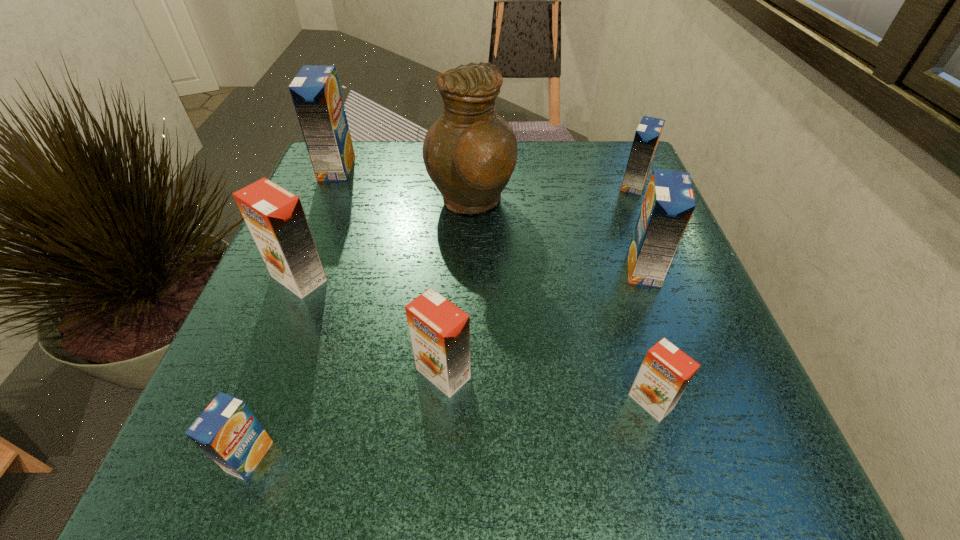
Identify the location of vacant area situated 0.130m on the back of the smallest blue orange_juice. The height and width of the screenshot is (540, 960). (287, 352).

This screenshot has height=540, width=960. Find the location of `pitcher that is at the far edge`. pitcher that is at the far edge is located at coordinates (470, 152).

This screenshot has width=960, height=540. Identify the location of object situated at the near edge. (227, 431).

This screenshot has height=540, width=960. I want to click on object that is at the far left corner, so click(315, 91).

At what (x,y) coordinates should I click in order to perform the action: click on object positioned at the near left corner. Please return your answer as a coordinate pair (x, y). This screenshot has height=540, width=960. Looking at the image, I should click on pos(227,431).

Identify the location of object positioned at the far right corner. (648, 133).

In the image, there is a desktop. In order to click on free space at the far edge in this screenshot , I will do `click(392, 178)`.

I want to click on vacant space at the near edge of the desktop, so click(x=355, y=430).

Locate an element on the screen. vacant region at the left edge of the desktop is located at coordinates (277, 287).

Locate an element on the screen. This screenshot has width=960, height=540. vacant space at the right edge of the desktop is located at coordinates (629, 235).